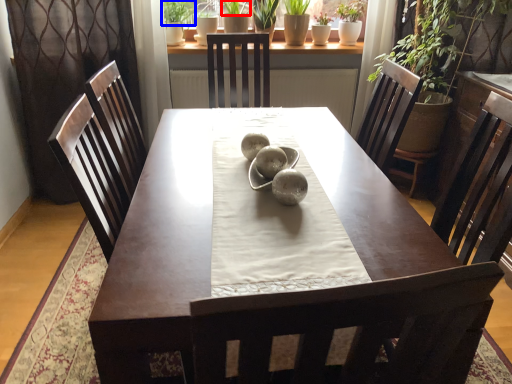
Question: Which of the following is the farthest to the observer, plant (highlighted by a red box) or plant (highlighted by a blue box)?

Choices:
 (A) plant
 (B) plant

Answer: (A)